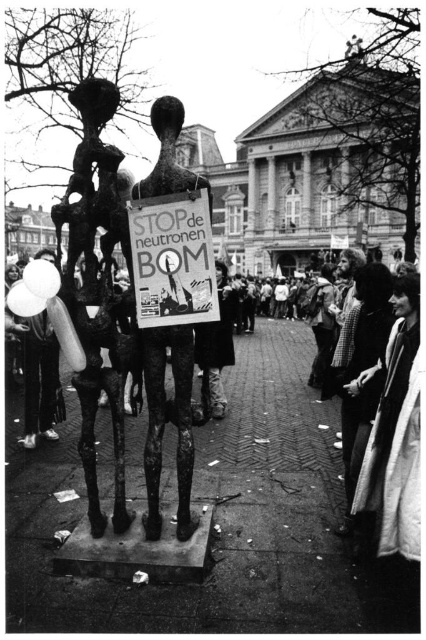
Based on the photo, can you confirm if bronze sculpture at center is positioned above metallic poster at center?

No, bronze sculpture at center is not above metallic poster at center.

Can you confirm if bronze sculpture at center is positioned to the right of metallic poster at center?

In fact, bronze sculpture at center is to the left of metallic poster at center.

Between point (65, 193) and point (138, 205), which one is positioned in front?

Point (138, 205)

The image size is (426, 640). Identify the location of bronze sculpture at center. (97, 289).